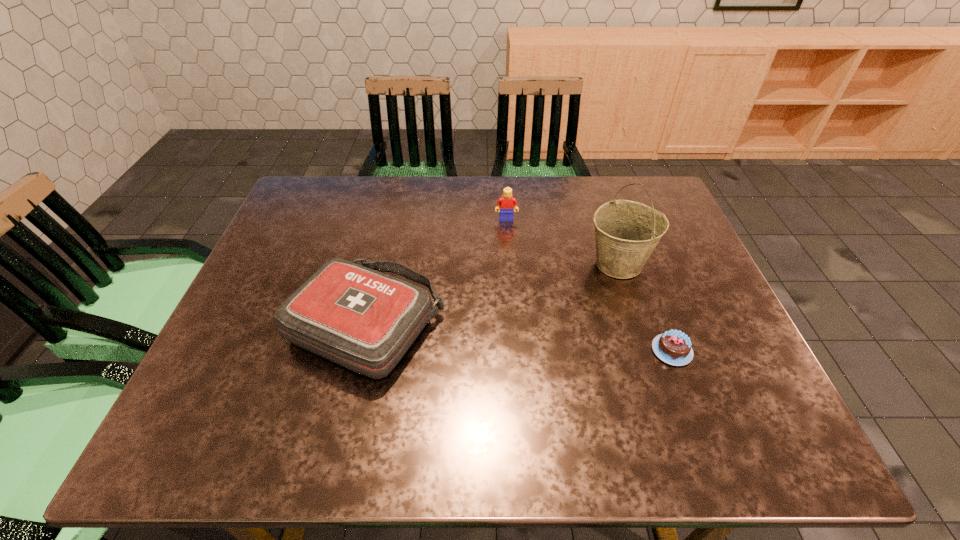
Find the location of `vacant space in between the shortest object and the Lego`. vacant space in between the shortest object and the Lego is located at coordinates (589, 285).

In order to click on vacant space in between the Lego and the chocolate cake in this screenshot , I will do `click(589, 285)`.

This screenshot has width=960, height=540. Identify the location of vacant space in between the wine bucket and the Lego. (563, 241).

Where is `vacant space that's between the wine bucket and the first-aid kit`? The width and height of the screenshot is (960, 540). vacant space that's between the wine bucket and the first-aid kit is located at coordinates (492, 294).

This screenshot has width=960, height=540. What are the coordinates of `vacant space that's between the Lego and the wine bucket` in the screenshot? It's located at (563, 241).

Locate an element on the screen. The height and width of the screenshot is (540, 960). unoccupied area between the chocolate cake and the first-aid kit is located at coordinates (519, 338).

Locate an element on the screen. The width and height of the screenshot is (960, 540). blank region between the leftmost object and the Lego is located at coordinates (437, 272).

I want to click on object that stands as the closest to the wine bucket, so click(x=673, y=347).

You are a GUI agent. You are given a task and a screenshot of the screen. Output one action in this format:
    pyautogui.click(x=<x>, y=<y>)
    Task: Click on the object that is the second closest to the chocolate cake
    Image resolution: width=960 pixels, height=540 pixels.
    Given the screenshot: What is the action you would take?
    pyautogui.click(x=364, y=320)

This screenshot has height=540, width=960. Find the location of `vacant space that satisfies the following two spatial constraints: 1. on the face of the chocolate cake; 2. on the right side of the Lego`. vacant space that satisfies the following two spatial constraints: 1. on the face of the chocolate cake; 2. on the right side of the Lego is located at coordinates (516, 350).